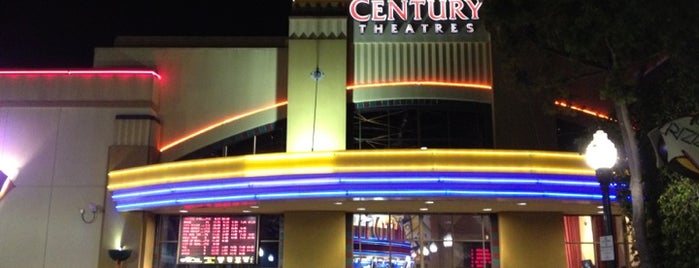
What are the coordinates of `door` in the screenshot? It's located at (460, 256).